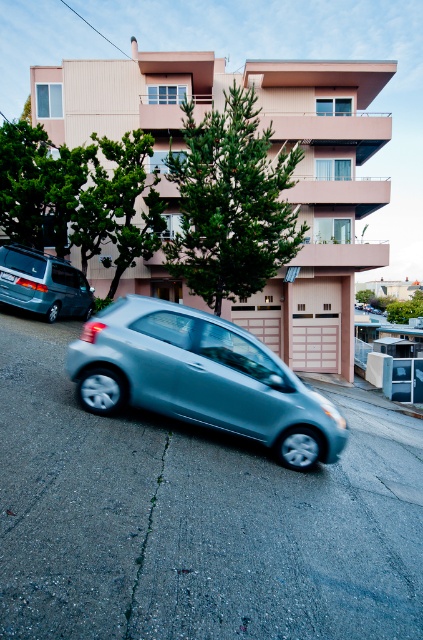
Question: Does satin silver car at center have a smaller size compared to metallic silver minivan at left?

Choices:
 (A) no
 (B) yes

Answer: (B)

Question: Can you confirm if satin silver car at center is positioned below metallic silver minivan at left?

Choices:
 (A) yes
 (B) no

Answer: (A)

Question: Is satin silver car at center to the right of metallic silver minivan at left from the viewer's perspective?

Choices:
 (A) no
 (B) yes

Answer: (B)

Question: Among these points, which one is nearest to the camera?

Choices:
 (A) (x=233, y=433)
 (B) (x=30, y=310)

Answer: (A)

Question: Which object is closer to the camera taking this photo?

Choices:
 (A) metallic silver minivan at left
 (B) satin silver car at center

Answer: (B)